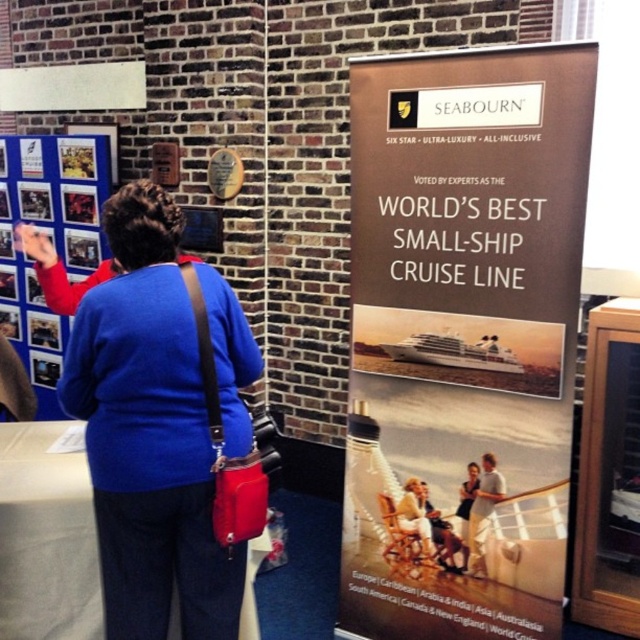
You are standing in front of a Seabourn cruise poster at an exhibition. There is a point marked at coordinates (x=51, y=241). Where exactly is this point located on the poster?

The point marked at coordinates (x=51, y=241) is located on the blue fabric poster at upper left.

You are at a cruise exhibition and see a woman holding a red purse. She is standing near two items both at the center of the scene. What is the position of the light brown leather jacket at center relative to the light brown leather chair at center?

The light brown leather jacket at center is positioned to the right of the light brown leather chair at center.